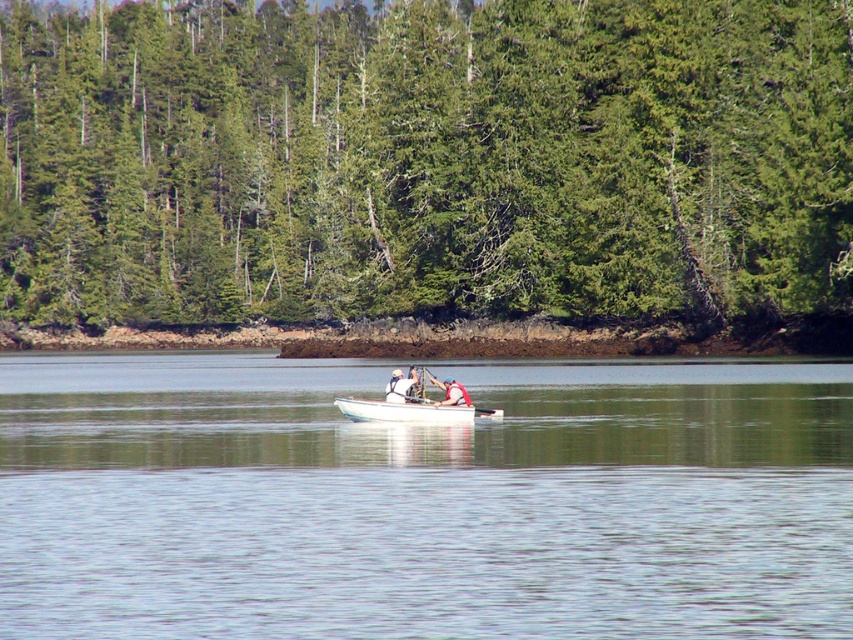
Question: Considering the relative positions of clear water at center and wooden paddle at center in the image provided, where is clear water at center located with respect to wooden paddle at center?

Choices:
 (A) left
 (B) right

Answer: (A)

Question: Which is farther from the clear water at center?

Choices:
 (A) green textured trees at center
 (B) white fabric life jacket at center
 (C) white fabric boat at center
 (D) white matte boat at center

Answer: (A)

Question: Considering the real-world distances, which object is farthest from the white matte boat at center?

Choices:
 (A) clear water at center
 (B) wooden paddle at center
 (C) white fabric at center
 (D) green textured trees at center

Answer: (D)

Question: Can you confirm if clear water at center is wider than white fabric life jacket at center?

Choices:
 (A) no
 (B) yes

Answer: (B)

Question: Which point is closer to the camera?

Choices:
 (A) white fabric at center
 (B) clear water at center
 (C) white fabric life jacket at center

Answer: (B)

Question: Is white matte boat at center bigger than white fabric life jacket at center?

Choices:
 (A) no
 (B) yes

Answer: (B)